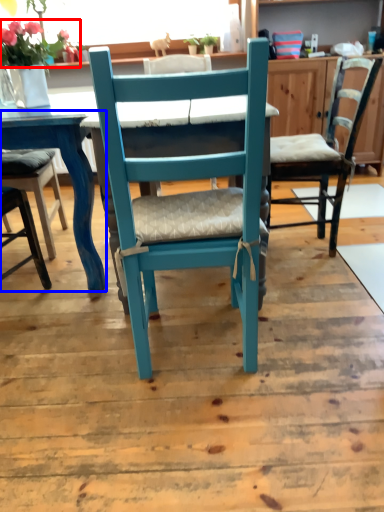
Question: Which object appears farthest to the camera in this image, flower (highlighted by a red box) or table (highlighted by a blue box)?

Choices:
 (A) flower
 (B) table

Answer: (A)